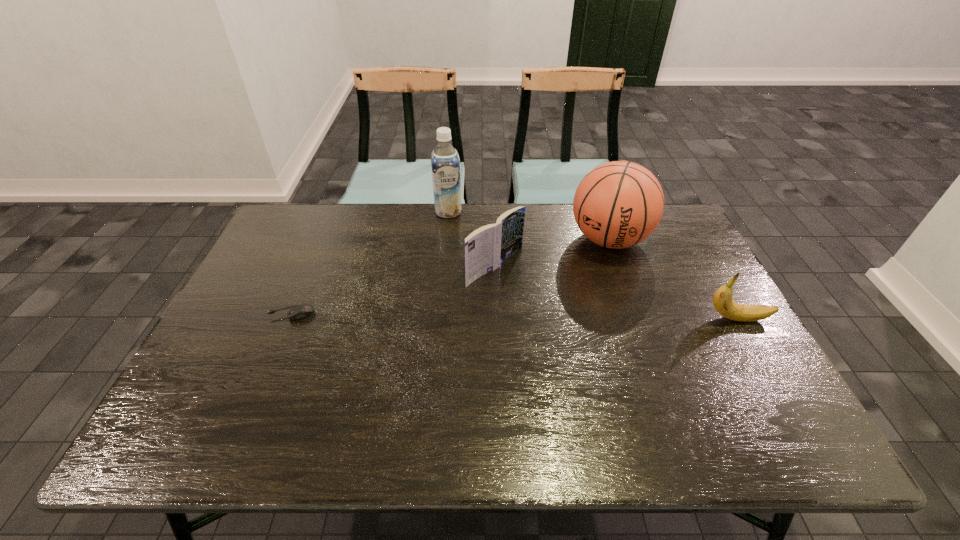
You are a GUI agent. You are given a task and a screenshot of the screen. Output one action in this format:
    pyautogui.click(x=<x>, y=<y>)
    Task: Click on the free spot on the desktop that is between the mouse and the banana and is positioned on the front cover of the third object from left to right
    
    Given the screenshot: What is the action you would take?
    pyautogui.click(x=570, y=317)

Where is `vacant spot on the desktop that is between the mouse and the rightmost object and is positioned on the surface of the fourth object from left to right near the brand logo`? This screenshot has height=540, width=960. vacant spot on the desktop that is between the mouse and the rightmost object and is positioned on the surface of the fourth object from left to right near the brand logo is located at coordinates (579, 317).

Locate an element on the screen. This screenshot has width=960, height=540. free space on the desktop that is between the shortest object and the rightmost object and is positioned on the label of the soya milk is located at coordinates (467, 315).